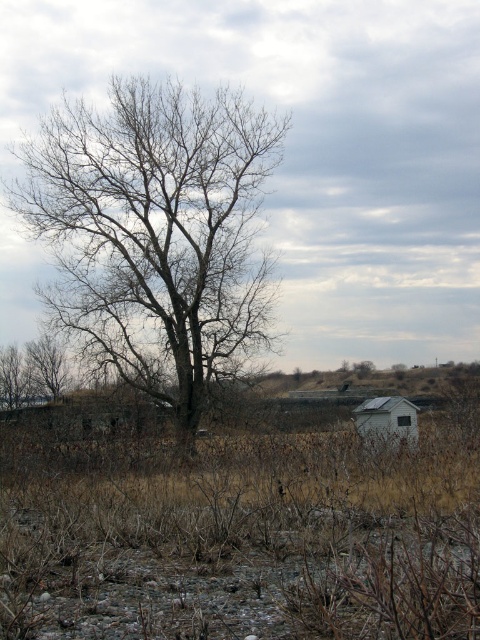
Which is behind, point (229, 132) or point (365, 410)?

Point (229, 132)

Does bare branches at center appear on the left side of white matte hut at lower right?

Indeed, bare branches at center is positioned on the left side of white matte hut at lower right.

Who is more forward, (179,118) or (367,416)?

Point (367,416) is in front.

This screenshot has width=480, height=640. Identify the location of bare branches at center. (156, 232).